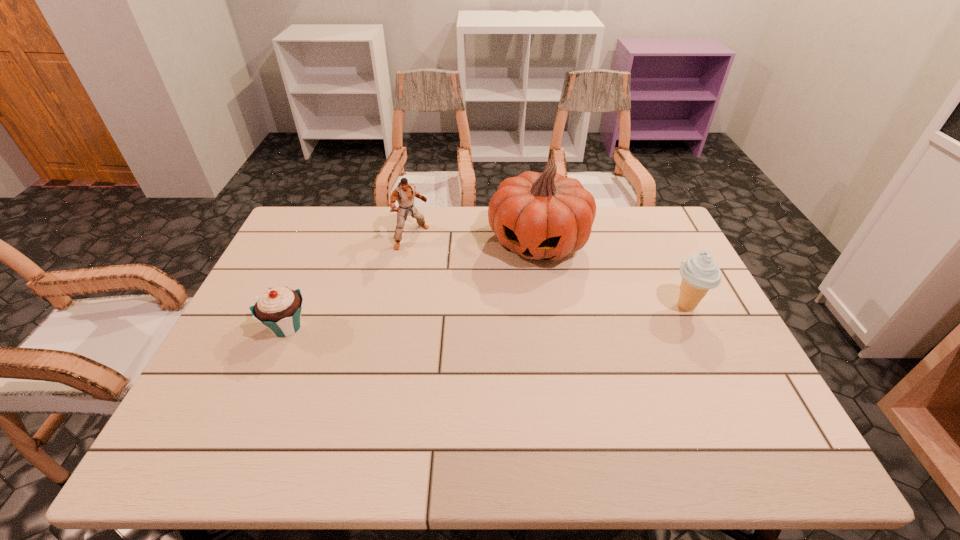
This screenshot has height=540, width=960. Find the location of `free space on the desktop that is between the leftmost object and the icecream and is positioned on the front-facing side of the puncher`. free space on the desktop that is between the leftmost object and the icecream and is positioned on the front-facing side of the puncher is located at coordinates (514, 315).

The height and width of the screenshot is (540, 960). Find the location of `free spot on the desktop that is between the cupcake and the icecream and is positioned on the face of the second object from right to left`. free spot on the desktop that is between the cupcake and the icecream and is positioned on the face of the second object from right to left is located at coordinates (x=509, y=315).